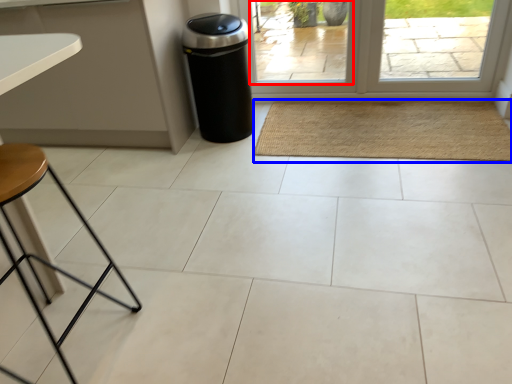
Question: Which object appears farthest to the camera in this image, window (highlighted by a red box) or mat (highlighted by a blue box)?

Choices:
 (A) window
 (B) mat

Answer: (A)